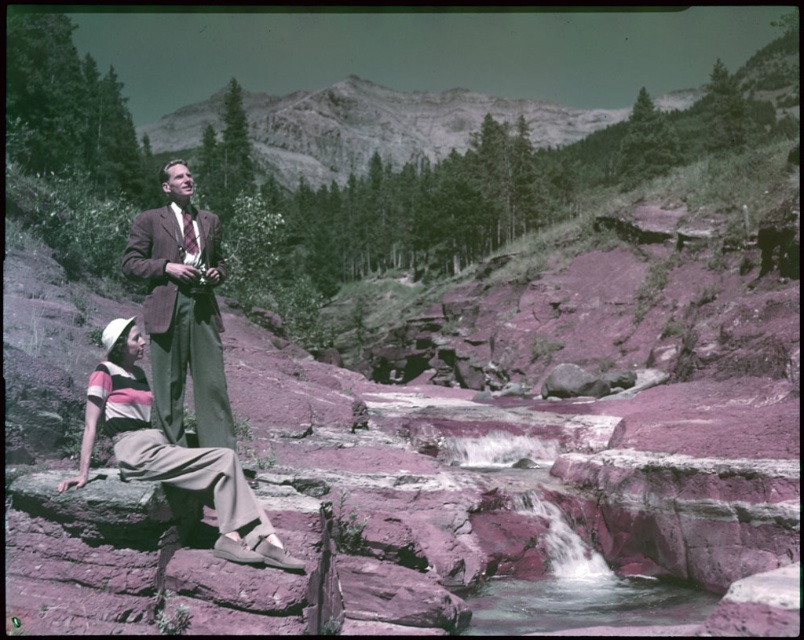
Which is more to the right, matte brown suit at center or striped cotton shirt at lower left?

striped cotton shirt at lower left

This screenshot has width=804, height=640. What do you see at coordinates (183, 308) in the screenshot? I see `matte brown suit at center` at bounding box center [183, 308].

What do you see at coordinates (183, 308) in the screenshot? I see `matte brown suit at center` at bounding box center [183, 308].

Identify the location of matte brown suit at center. The height and width of the screenshot is (640, 804). (183, 308).